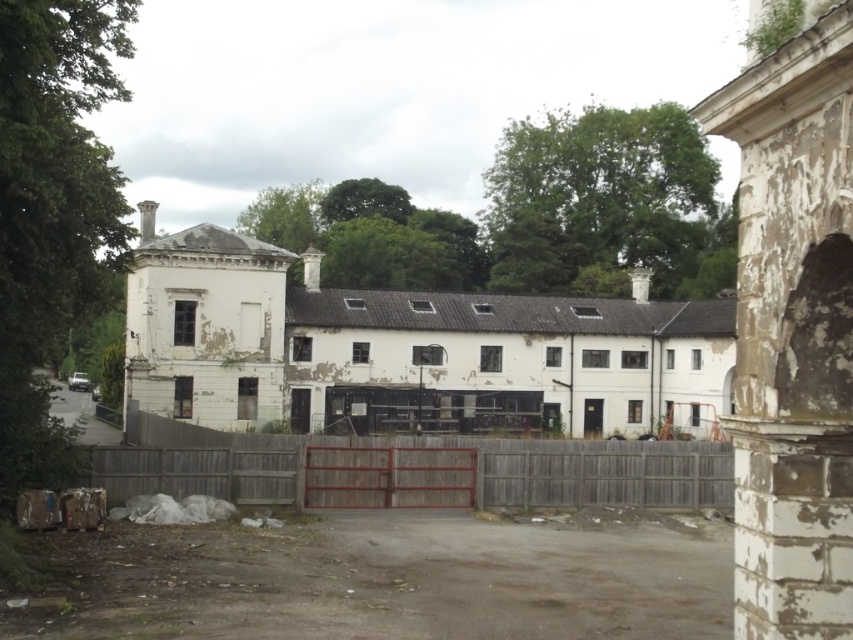
Is wooden gate at center positioned in front of white peeling plaster archway at right?

No, wooden gate at center is further to the viewer.

Is wooden gate at center above white peeling plaster archway at right?

Incorrect, wooden gate at center is not positioned above white peeling plaster archway at right.

Is point (421, 456) farther from camera compared to point (849, 380)?

Yes, point (421, 456) is farther from viewer.

Identify the location of wooden gate at center. Image resolution: width=853 pixels, height=640 pixels. (428, 474).